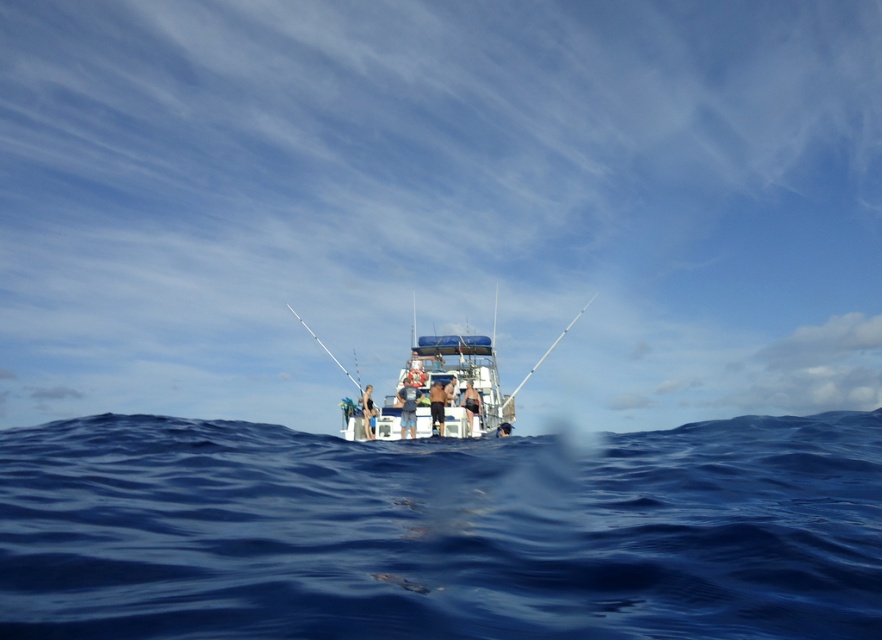
You are a sailor on the boat and want to know which object occupies more space in the image between the deep blue water at center and the white fiberglass fishing pole at center. Could you determine this based on their sizes?

The deep blue water at center has a larger size compared to the white fiberglass fishing pole at center, so the deep blue water at center occupies more space in the image.

You are a sailor on the boat and you want to retrieve the white fiberglass fishing pole at center. However, there is a sudden wave coming towards the deep blue water at center. Which object will be hit by the wave first?

The deep blue water at center is in front of the white fiberglass fishing pole at center, so the wave will hit the deep blue water at center first before reaching the fishing pole.

You are a sailor on the fishing boat and you want to retrieve the white fiberglass fishing pole at center. Which direction should you move relative to the deep blue water at center?

To retrieve the white fiberglass fishing pole at center, you should move to the right of the deep blue water at center since the pole is located to its right side.